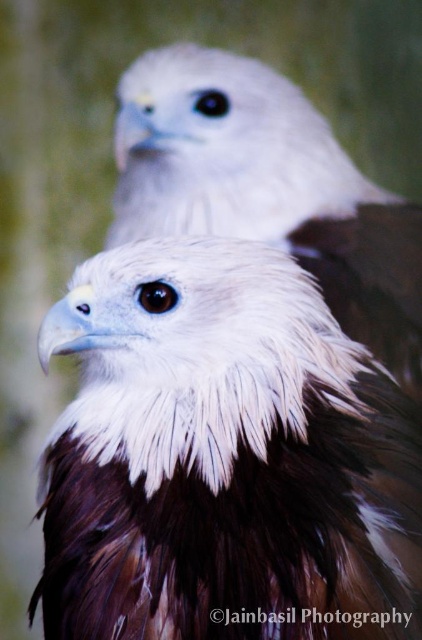
You are a wildlife photographer aiming to capture the largest bird in the scene. Which bird should you focus on, the white feathered eagle at center or the white fluffy eagle at upper center?

The white fluffy eagle at upper center is larger because it is thicker than the white feathered eagle at center.

You are a photographer aiming to capture a clear shot of both birds in the image. The birds are located at point (x=161, y=442) and point (x=278, y=214). Given that the foreground bird is at one of these points, which point corresponds to the foreground bird?

Point (x=161, y=442) is in front of point (x=278, y=214), so the foreground bird is at point (x=161, y=442).

You are a photographer aiming to capture a close up of the white feathered eagle at center. Based on the scene description, what are the coordinates where you should focus your camera?

The white feathered eagle at center is positioned at coordinates point (224, 458), so you should focus your camera at point (224, 458) to capture the close up.